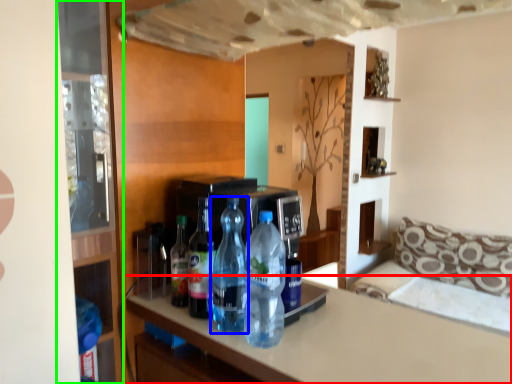
Question: Considering the real-world distances, which object is farthest from countertop (highlighted by a red box)? bottle (highlighted by a blue box) or glass door (highlighted by a green box)?

Choices:
 (A) bottle
 (B) glass door

Answer: (B)